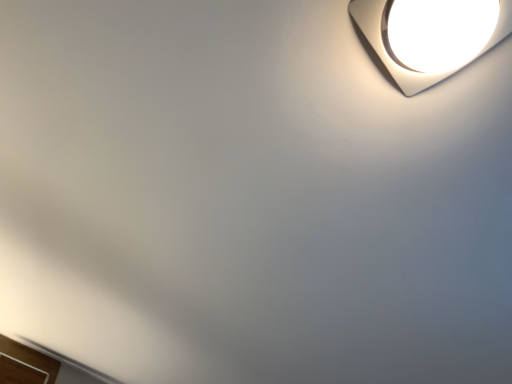
Describe the element at coordinates (400, 66) in the screenshot. The height and width of the screenshot is (384, 512). I see `white glossy lamp at upper right` at that location.

Locate an element on the screen. white glossy lamp at upper right is located at coordinates (400, 66).

The height and width of the screenshot is (384, 512). What are the coordinates of `white glossy lamp at upper right` in the screenshot? It's located at (400, 66).